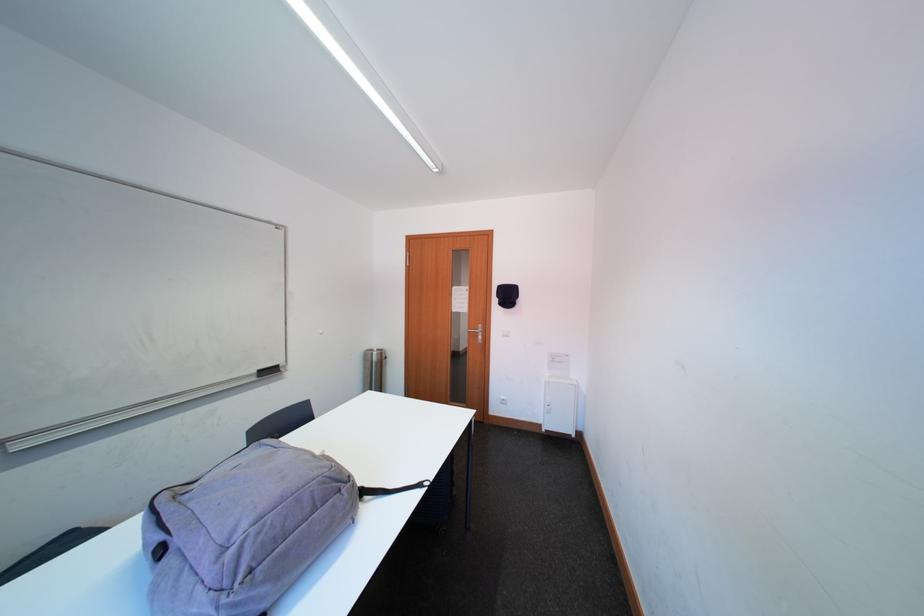
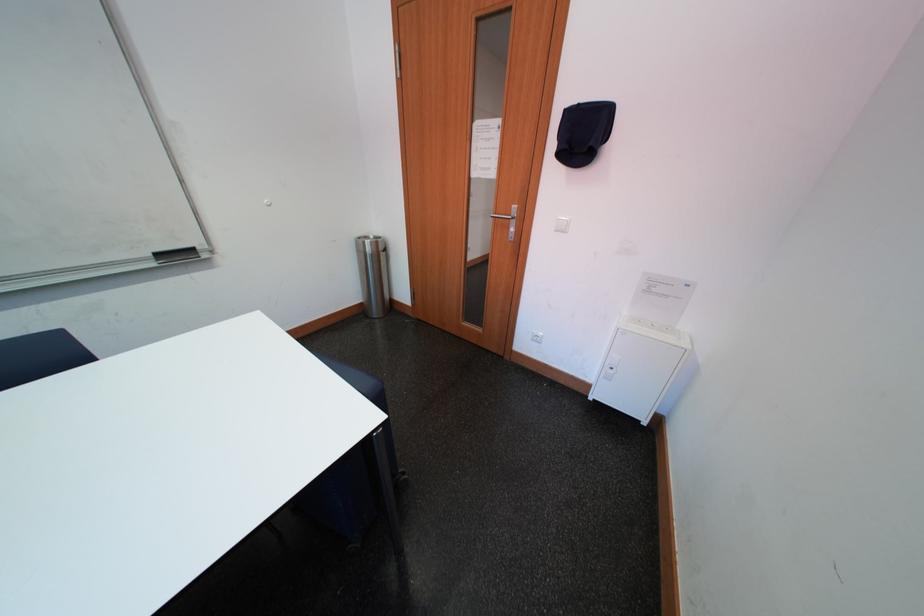
In the second image, find the point that corresponds to (x=517, y=300) in the first image.

(593, 140)